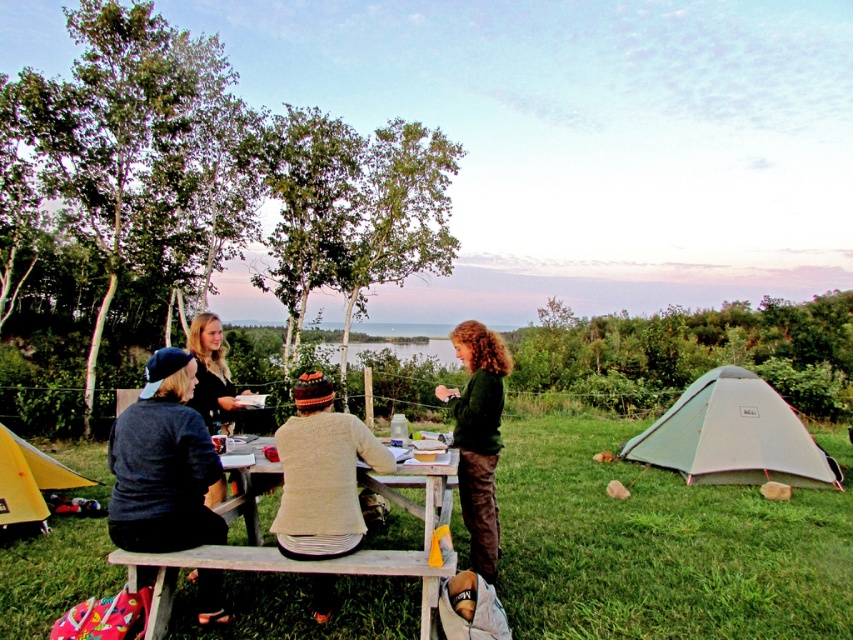
Does point (202, 544) lie behind point (230, 422)?

No, it is in front of (230, 422).

Who is more forward, (x=161, y=499) or (x=195, y=326)?

Point (x=161, y=499) is more forward.

Between point (170, 492) and point (212, 362), which one is positioned behind?

The point (212, 362) is behind.

Locate an element on the screen. The width and height of the screenshot is (853, 640). dark gray sweater at lower left is located at coordinates (163, 465).

Describe the element at coordinates (733, 435) in the screenshot. This screenshot has width=853, height=640. I see `white fabric tent at right` at that location.

Is white fabric tent at right above yellow fabric tent at lower left?

No.

Describe the element at coordinates (733, 435) in the screenshot. I see `white fabric tent at right` at that location.

At what (x,y) coordinates should I click in order to perform the action: click on white fabric tent at right. Please return your answer as a coordinate pair (x, y). Looking at the image, I should click on (733, 435).

How distant is knitted beige sweater at center from yellow fabric tent at lower left?

knitted beige sweater at center is 3.75 meters from yellow fabric tent at lower left.

Is knitted beige sweater at center closer to camera compared to yellow fabric tent at lower left?

Yes.

Is point (293, 442) positioned behind point (15, 461)?

No, it is not.

Locate an element on the screen. The width and height of the screenshot is (853, 640). knitted beige sweater at center is located at coordinates (321, 474).